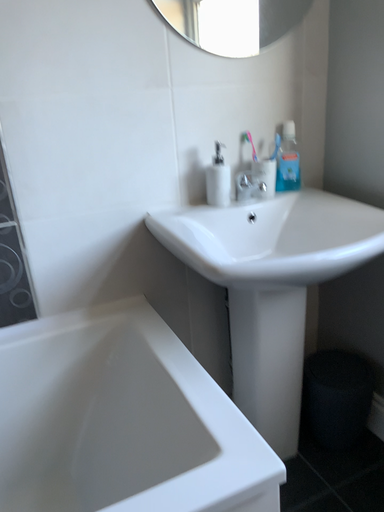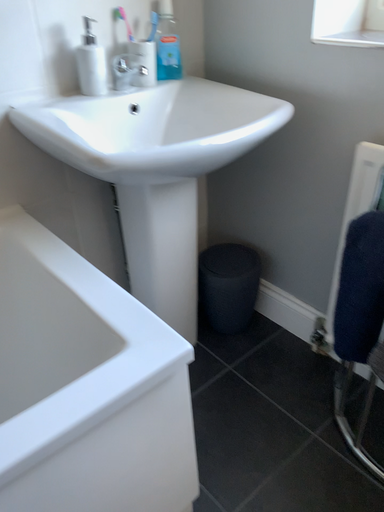
Question: Which way did the camera rotate in the video?

Choices:
 (A) rotated left
 (B) rotated right

Answer: (B)